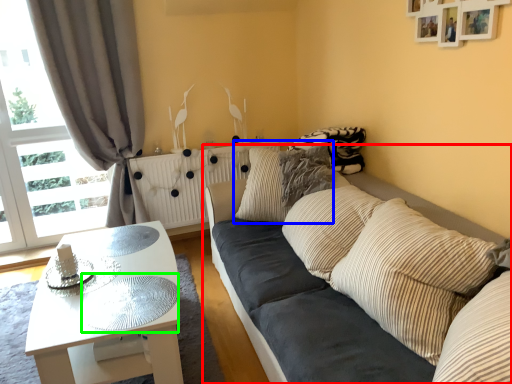
Question: Which is farther away from studio couch (highlighted by a red box)? pillow (highlighted by a blue box) or glass table (highlighted by a green box)?

Choices:
 (A) pillow
 (B) glass table

Answer: (B)